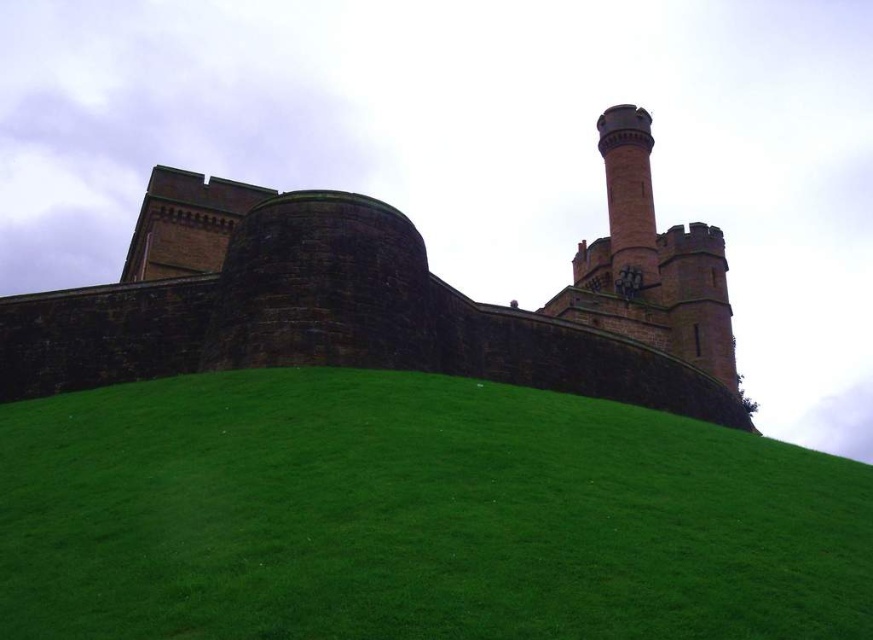
Which is in front, point (403, 634) or point (616, 266)?

Point (403, 634) is in front.

Does point (222, 576) come behind point (610, 173)?

No, it is not.

Is point (328, 486) farther from viewer compared to point (624, 257)?

No.

Locate an element on the screen. Image resolution: width=873 pixels, height=640 pixels. green grassy hill at lower center is located at coordinates (416, 516).

Can you confirm if green grassy hill at lower center is thinner than brown stone castle at upper center?

Correct, green grassy hill at lower center's width is less than brown stone castle at upper center's.

Does green grassy hill at lower center have a larger size compared to brown stone castle at upper center?

Actually, green grassy hill at lower center might be smaller than brown stone castle at upper center.

Is point (220, 396) closer to camera compared to point (139, 317)?

Yes.

Find the location of a particular element. The width and height of the screenshot is (873, 640). green grassy hill at lower center is located at coordinates click(x=416, y=516).

Does brown stone castle at upper center have a greater height compared to red brick chimney at upper right?

Indeed, brown stone castle at upper center has a greater height compared to red brick chimney at upper right.

Locate an element on the screen. brown stone castle at upper center is located at coordinates (388, 298).